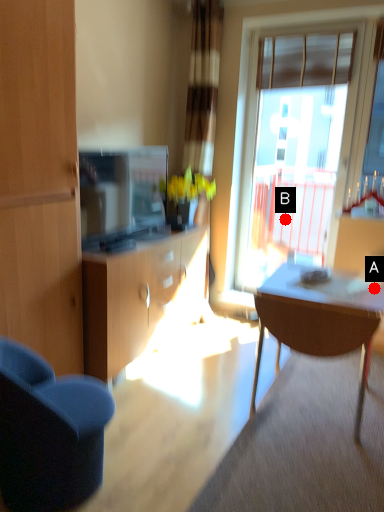
Question: Two points are circled on the image, labeled by A and B beside each circle. Which point is farther to the camera?

Choices:
 (A) A is further
 (B) B is further

Answer: (B)